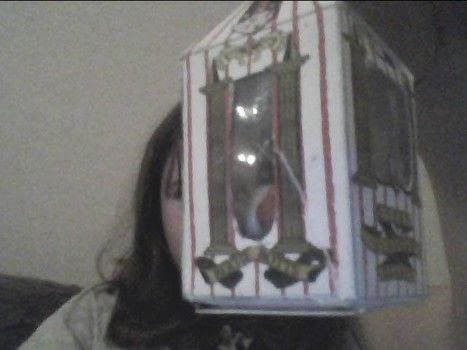
This screenshot has height=350, width=467. I want to click on wall, so click(x=82, y=171).